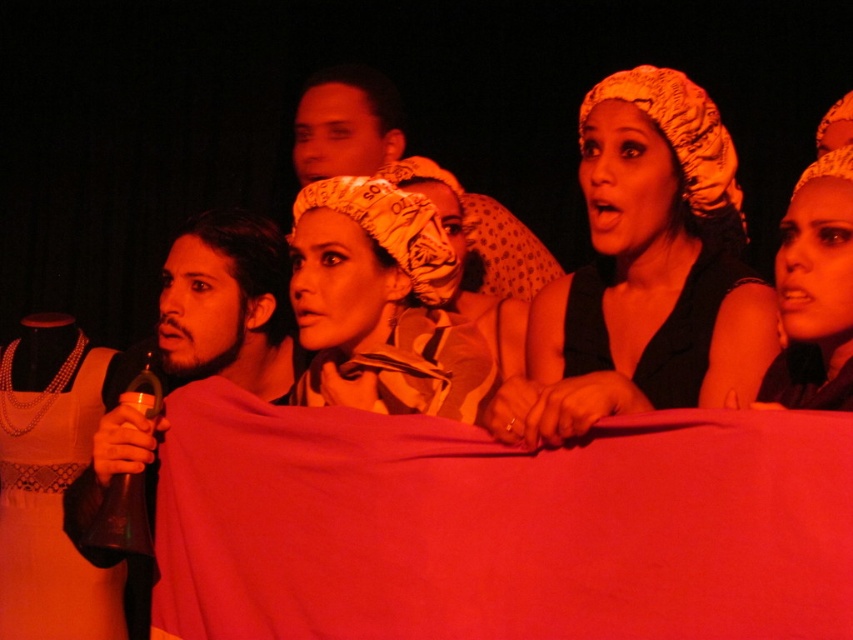
You are an event coordinator planning to place a 1.2 meter tall decoration in the center of the stage. The silky red fabric at center and the printed silk headscarf at center are already there. Which object will be partially covered by the decoration?

The silky red fabric at center will be partially covered by the decoration because it is shorter than the printed silk headscarf at center, meaning it is closer to the ground and thus more likely to be under the decoration.

You are a stagehand setting up for a performance. You need to determine if the silky red fabric at center can be moved to the left side without overlapping the white lace dress at left. Based on their sizes, is this possible?

The silky red fabric at center occupies less space than the white lace dress at left, so it is possible to move the silky red fabric at center to the left side without overlapping the white lace dress at left if there is sufficient space between them.

You are an event photographer at the scene. You need to capture a closeup of the matte yellow headscarf at upper right and the matte beige headscarf at upper right. Which one can you focus on without adjusting your camera focus?

The matte yellow headscarf at upper right is closer to you than the matte beige headscarf at upper right, so you can focus on the matte yellow headscarf at upper right without adjusting your camera focus.